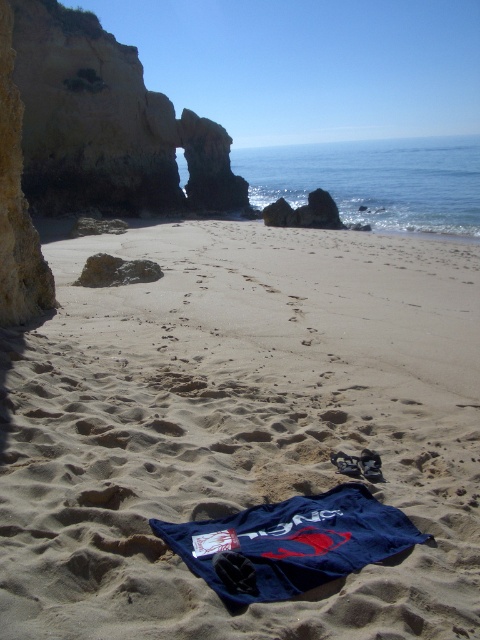
Question: Can you confirm if sandy textured towel at center is positioned below brown rocky arch at upper left?

Choices:
 (A) no
 (B) yes

Answer: (B)

Question: Which of the following is the closest to the observer?

Choices:
 (A) brown rocky arch at upper left
 (B) sandy textured towel at center

Answer: (B)

Question: Observing the image, what is the correct spatial positioning of sandy textured towel at center in reference to brown rocky arch at upper left?

Choices:
 (A) right
 (B) left

Answer: (A)

Question: Which of the following is the closest to the observer?

Choices:
 (A) tap(432, 276)
 (B) tap(28, 138)

Answer: (A)

Question: Which point appears farthest from the camera in this image?

Choices:
 (A) (425, 531)
 (B) (237, 177)

Answer: (B)

Question: Does sandy textured towel at center appear over brown rocky arch at upper left?

Choices:
 (A) no
 (B) yes

Answer: (A)